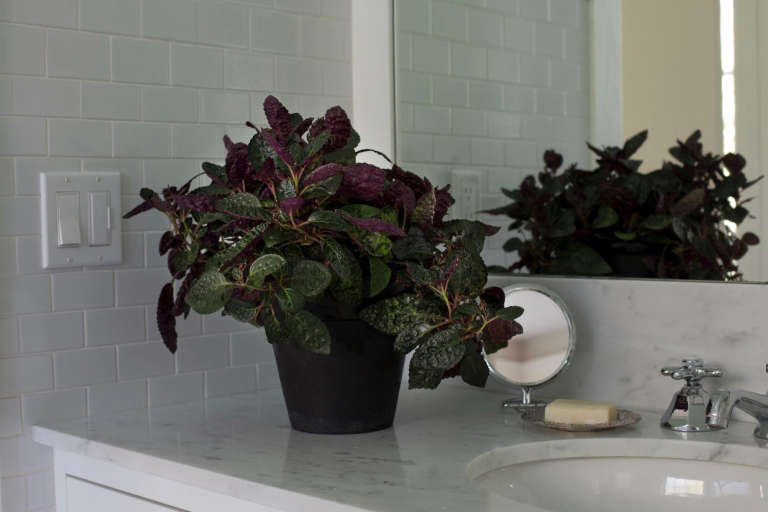
At what (x,y) coordinates should I click in order to perform the action: click on wall. Please return your answer as a coordinate pair (x, y). The width and height of the screenshot is (768, 512). Looking at the image, I should click on (159, 141).